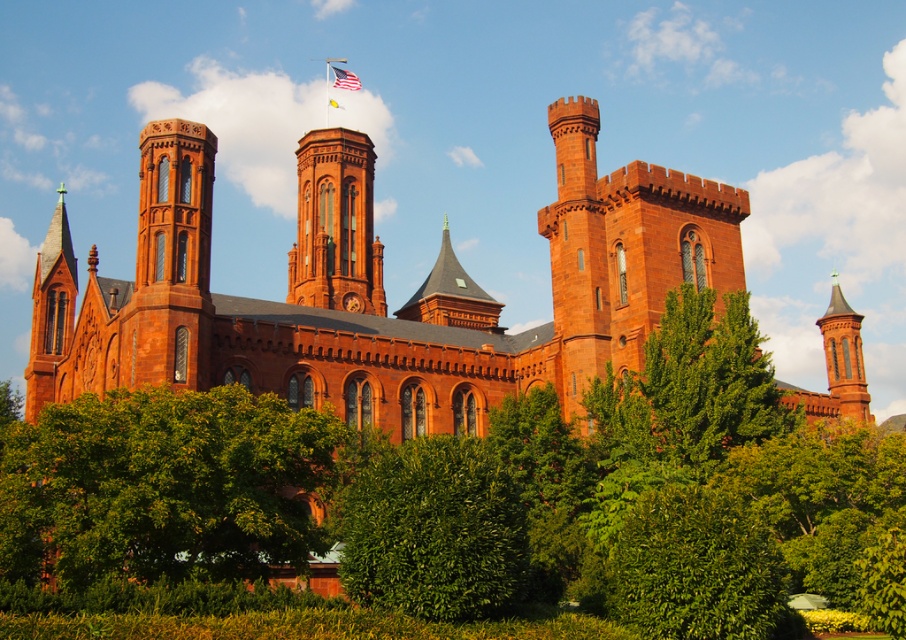
Can you confirm if american flag at center is positioned to the right of silky fabric flag at upper center?

Indeed, american flag at center is positioned on the right side of silky fabric flag at upper center.

What do you see at coordinates (345, 80) in the screenshot? I see `american flag at center` at bounding box center [345, 80].

What are the coordinates of `american flag at center` in the screenshot? It's located at (345, 80).

Measure the distance between point (348, 390) and camera.

Point (348, 390) and camera are 213.19 feet apart from each other.

From the picture: Does matte brick church at center have a greater width compared to matte brick tower at right?

Yes, matte brick church at center is wider than matte brick tower at right.

You are a GUI agent. You are given a task and a screenshot of the screen. Output one action in this format:
    pyautogui.click(x=<x>, y=<y>)
    Task: Click on the matte brick church at center
    The width and height of the screenshot is (906, 640).
    Given the screenshot: What is the action you would take?
    pyautogui.click(x=393, y=310)

Between matte brick tower at right and american flag at center, which one has less height?

With less height is american flag at center.

The image size is (906, 640). I want to click on matte brick tower at right, so click(x=844, y=356).

At what (x,y) coordinates should I click in order to perform the action: click on matte brick tower at right. Please return your answer as a coordinate pair (x, y). Image resolution: width=906 pixels, height=640 pixels. Looking at the image, I should click on (844, 356).

At what (x,y) coordinates should I click in order to perform the action: click on matte brick tower at right. Please return your answer as a coordinate pair (x, y). The height and width of the screenshot is (640, 906). Looking at the image, I should click on (844, 356).